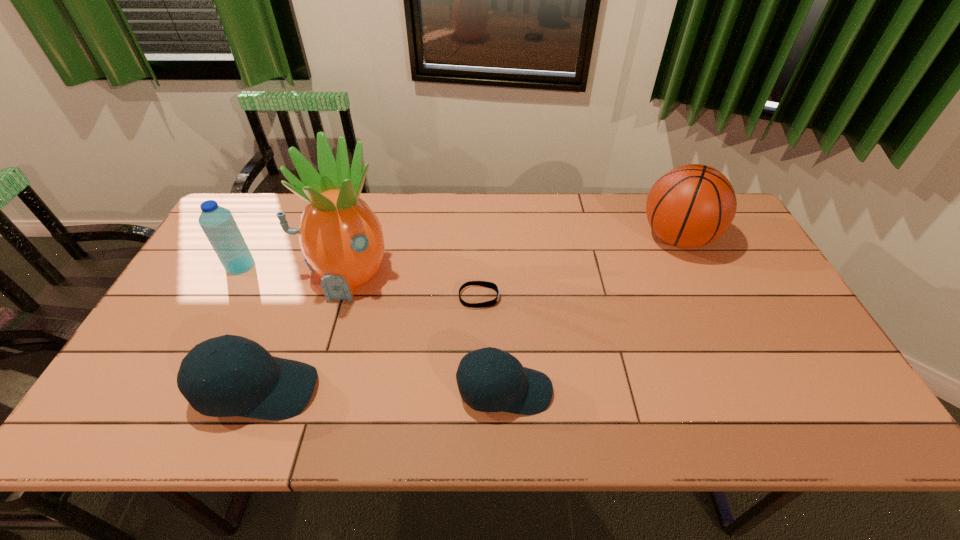
Locate an element on the screen. vacant space located on the front of the leftmost object is located at coordinates (228, 291).

Where is `free space located on the left of the basketball`? Image resolution: width=960 pixels, height=540 pixels. free space located on the left of the basketball is located at coordinates (525, 238).

Find the location of a particular element. This screenshot has width=960, height=540. free point located 0.250m at the entrance of the tallest object is located at coordinates (313, 389).

What are the coordinates of `vacant space situated 0.300m on the display of the wristband` in the screenshot? It's located at (608, 298).

Where is `object located in the far edge section of the desktop`? The width and height of the screenshot is (960, 540). object located in the far edge section of the desktop is located at coordinates (692, 205).

Image resolution: width=960 pixels, height=540 pixels. Find the location of `object at the left edge`. object at the left edge is located at coordinates (218, 224).

Identify the location of object located in the right edge section of the desktop. The height and width of the screenshot is (540, 960). (692, 205).

Locate an element on the screen. This screenshot has width=960, height=540. object situated at the far right corner is located at coordinates (692, 205).

I want to click on free space at the far edge of the desktop, so point(473,195).

Image resolution: width=960 pixels, height=540 pixels. I want to click on free region at the near edge of the desktop, so click(345, 373).